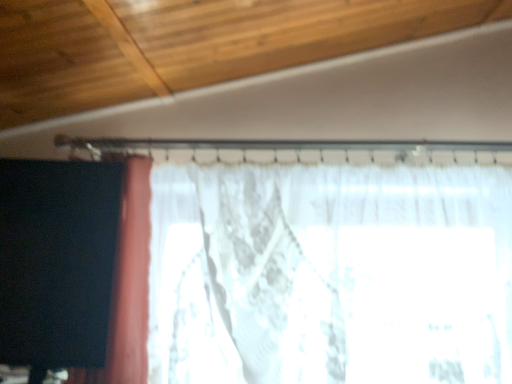
Question: Does white lace curtain at left, the second curtain viewed from the left, come behind black matte curtain at left, which is counted as the 1th curtain, starting from the left?

Choices:
 (A) yes
 (B) no

Answer: (A)

Question: From the image's perspective, is white lace curtain at left, acting as the 1th curtain starting from the right, beneath black matte curtain at left, the 2th curtain viewed from the right?

Choices:
 (A) no
 (B) yes

Answer: (B)

Question: Can you confirm if white lace curtain at left, acting as the 1th curtain starting from the right, is positioned to the right of black matte curtain at left, the 2th curtain viewed from the right?

Choices:
 (A) no
 (B) yes

Answer: (B)

Question: Is black matte curtain at left, the 2th curtain viewed from the right, at the back of white lace curtain at left, the second curtain viewed from the left?

Choices:
 (A) no
 (B) yes

Answer: (A)

Question: Would you consider white lace curtain at left, acting as the 1th curtain starting from the right, to be distant from black matte curtain at left, the 2th curtain viewed from the right?

Choices:
 (A) yes
 (B) no

Answer: (B)

Question: Is white lace curtain at left, acting as the 1th curtain starting from the right, taller than black matte curtain at left, which is counted as the 1th curtain, starting from the left?

Choices:
 (A) yes
 (B) no

Answer: (A)

Question: Considering the relative positions of black matte curtain at left, which is counted as the 1th curtain, starting from the left, and white lace curtain at left, acting as the 1th curtain starting from the right, in the image provided, is black matte curtain at left, which is counted as the 1th curtain, starting from the left, to the left of white lace curtain at left, acting as the 1th curtain starting from the right, from the viewer's perspective?

Choices:
 (A) no
 (B) yes

Answer: (B)

Question: Considering the relative sizes of black matte curtain at left, the 2th curtain viewed from the right, and white lace curtain at left, acting as the 1th curtain starting from the right, in the image provided, is black matte curtain at left, the 2th curtain viewed from the right, shorter than white lace curtain at left, acting as the 1th curtain starting from the right,?

Choices:
 (A) yes
 (B) no

Answer: (A)

Question: Is black matte curtain at left, the 2th curtain viewed from the right, positioned far away from white lace curtain at left, acting as the 1th curtain starting from the right?

Choices:
 (A) yes
 (B) no

Answer: (B)

Question: From the image's perspective, is black matte curtain at left, which is counted as the 1th curtain, starting from the left, under white lace curtain at left, the second curtain viewed from the left?

Choices:
 (A) no
 (B) yes

Answer: (A)

Question: Would you say black matte curtain at left, which is counted as the 1th curtain, starting from the left, is outside white lace curtain at left, acting as the 1th curtain starting from the right?

Choices:
 (A) yes
 (B) no

Answer: (A)

Question: From the image's perspective, does black matte curtain at left, the 2th curtain viewed from the right, appear higher than white lace curtain at left, acting as the 1th curtain starting from the right?

Choices:
 (A) no
 (B) yes

Answer: (B)

Question: Is white lace curtain at left, acting as the 1th curtain starting from the right, in front of or behind black matte curtain at left, which is counted as the 1th curtain, starting from the left, in the image?

Choices:
 (A) behind
 (B) front

Answer: (A)